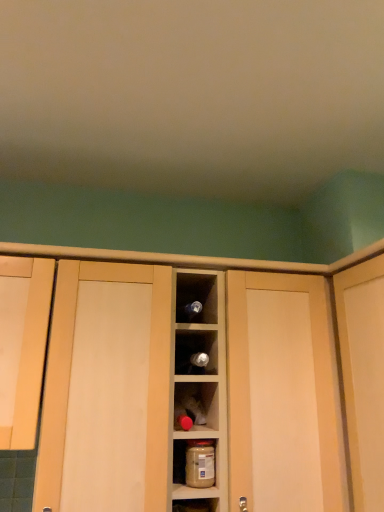
Question: Is matte wood door at right inside wooden cabinet at center, the 2th cabinetry from the left?

Choices:
 (A) no
 (B) yes

Answer: (A)

Question: Can you confirm if wooden cabinet at center, arranged as the first cabinetry when viewed from the right, is taller than matte wood door at right?

Choices:
 (A) yes
 (B) no

Answer: (A)

Question: Is wooden cabinet at center, the 2th cabinetry from the left, aimed at matte wood door at right?

Choices:
 (A) no
 (B) yes

Answer: (A)

Question: Considering the relative sizes of wooden cabinet at center, the 2th cabinetry from the left, and matte wood door at right in the image provided, is wooden cabinet at center, the 2th cabinetry from the left, shorter than matte wood door at right?

Choices:
 (A) yes
 (B) no

Answer: (B)

Question: Does wooden cabinet at center, arranged as the first cabinetry when viewed from the right, have a smaller size compared to matte wood door at right?

Choices:
 (A) no
 (B) yes

Answer: (A)

Question: From a real-world perspective, is wooden cabinet at center, the 2th cabinetry from the left, positioned under matte wood door at right based on gravity?

Choices:
 (A) yes
 (B) no

Answer: (A)

Question: Is matte wood door at right with wooden cabinet at center, the 2th cabinetry from the left?

Choices:
 (A) yes
 (B) no

Answer: (B)

Question: Is matte wood door at right facing away from wooden cabinet at center, the 2th cabinetry from the left?

Choices:
 (A) yes
 (B) no

Answer: (B)

Question: Is matte wood door at right positioned before wooden cabinet at center, arranged as the first cabinetry when viewed from the right?

Choices:
 (A) yes
 (B) no

Answer: (A)

Question: From the image's perspective, is matte wood door at right on wooden cabinet at center, arranged as the first cabinetry when viewed from the right?

Choices:
 (A) no
 (B) yes

Answer: (B)

Question: Is matte wood door at right smaller than wooden cabinet at center, the 2th cabinetry from the left?

Choices:
 (A) yes
 (B) no

Answer: (A)

Question: Can you confirm if matte wood door at right is positioned to the left of wooden cabinet at center, arranged as the first cabinetry when viewed from the right?

Choices:
 (A) yes
 (B) no

Answer: (B)

Question: Is matte wood door at right bigger than matte wood cabinet at left, which appears as the 1th cabinetry when viewed from the left?

Choices:
 (A) yes
 (B) no

Answer: (A)